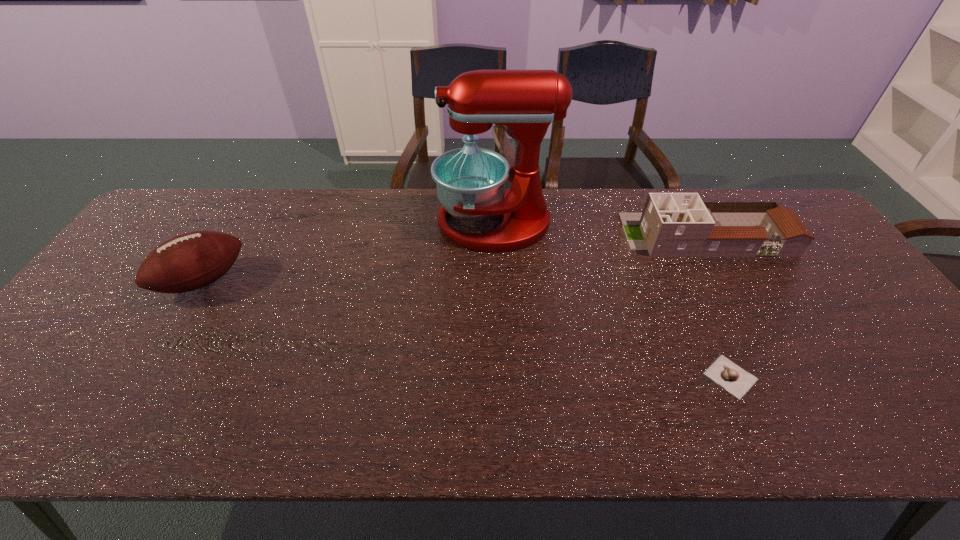
This screenshot has width=960, height=540. Identify the location of the second object from left to right. (470, 181).

You are a GUI agent. You are given a task and a screenshot of the screen. Output one action in this format:
    pyautogui.click(x=<x>, y=<y>)
    Task: Click on the tallest object
    This screenshot has width=960, height=540.
    Given the screenshot: What is the action you would take?
    pyautogui.click(x=470, y=181)

Identify the location of dollhouse. point(672,224).

This screenshot has height=540, width=960. Identify the location of the leftmost object. (187, 262).

Locate an element on the screen. football (American) is located at coordinates (187, 262).

What are the coordinates of `the nearest object` in the screenshot? It's located at (735, 380).

The height and width of the screenshot is (540, 960). I want to click on garlic, so click(735, 380).

The width and height of the screenshot is (960, 540). Identify the location of vacant space located on the front-facing side of the second object from left to right. click(x=395, y=223).

Where is `free space located on the front-facing side of the second object from left to right`? free space located on the front-facing side of the second object from left to right is located at coordinates (341, 223).

I want to click on free location located on the front-facing side of the second object from left to right, so click(x=328, y=223).